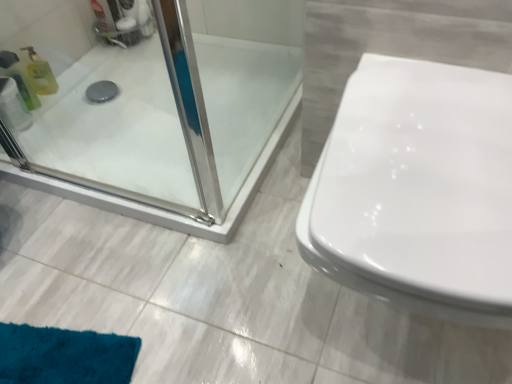
Question: Does translucent yellow bottle at left, the second cleaning product positioned from the back, have a lesser height compared to transparent plastic toilet paper at upper left?

Choices:
 (A) no
 (B) yes

Answer: (A)

Question: Does translucent yellow bottle at left, the first cleaning product positioned from the front, have a lesser width compared to transparent plastic toilet paper at upper left?

Choices:
 (A) no
 (B) yes

Answer: (B)

Question: Is translucent yellow bottle at left, the first cleaning product positioned from the front, completely or partially outside of transparent plastic toilet paper at upper left?

Choices:
 (A) yes
 (B) no

Answer: (A)

Question: Is translucent yellow bottle at left, the second cleaning product positioned from the back, bigger than transparent plastic toilet paper at upper left?

Choices:
 (A) yes
 (B) no

Answer: (B)

Question: Is translucent yellow bottle at left, the first cleaning product positioned from the front, oriented away from transparent plastic toilet paper at upper left?

Choices:
 (A) yes
 (B) no

Answer: (B)

Question: Is translucent yellow bottle at left, the second cleaning product positioned from the back, further to camera compared to transparent plastic toilet paper at upper left?

Choices:
 (A) no
 (B) yes

Answer: (B)

Question: From a real-world perspective, is translucent yellow bottle at left, the first cleaning product positioned from the front, over white glossy toilet at right?

Choices:
 (A) no
 (B) yes

Answer: (A)

Question: Considering the relative sizes of translucent yellow bottle at left, the first cleaning product positioned from the front, and white glossy toilet at right in the image provided, is translucent yellow bottle at left, the first cleaning product positioned from the front, smaller than white glossy toilet at right?

Choices:
 (A) yes
 (B) no

Answer: (A)

Question: Is translucent yellow bottle at left, the first cleaning product positioned from the front, positioned with its back to white glossy toilet at right?

Choices:
 (A) yes
 (B) no

Answer: (B)

Question: Is translucent yellow bottle at left, the first cleaning product positioned from the front, at the right side of white glossy toilet at right?

Choices:
 (A) no
 (B) yes

Answer: (A)

Question: Does translucent yellow bottle at left, the first cleaning product positioned from the front, have a greater width compared to white glossy toilet at right?

Choices:
 (A) no
 (B) yes

Answer: (A)

Question: Is white glossy toilet at right inside translucent yellow bottle at left, the first cleaning product positioned from the front?

Choices:
 (A) no
 (B) yes

Answer: (A)

Question: From the image's perspective, is transparent plastic toilet paper at upper left located above white glossy toilet at right?

Choices:
 (A) no
 (B) yes

Answer: (B)